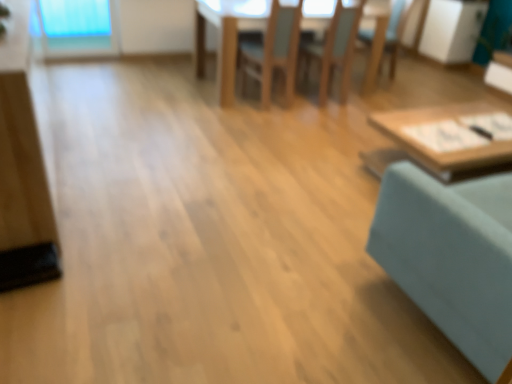
Question: Does teal fabric swivel chair at right lie in front of wooden chair at center, which is the 1th chair from left to right?

Choices:
 (A) no
 (B) yes

Answer: (B)

Question: Is teal fabric swivel chair at right thinner than wooden chair at center, positioned as the 3th chair in right-to-left order?

Choices:
 (A) yes
 (B) no

Answer: (B)

Question: Considering the relative sizes of teal fabric swivel chair at right and wooden chair at center, which is the 1th chair from left to right, in the image provided, is teal fabric swivel chair at right shorter than wooden chair at center, which is the 1th chair from left to right,?

Choices:
 (A) yes
 (B) no

Answer: (A)

Question: Does teal fabric swivel chair at right have a greater height compared to wooden chair at center, positioned as the 3th chair in right-to-left order?

Choices:
 (A) no
 (B) yes

Answer: (A)

Question: Is the position of teal fabric swivel chair at right more distant than that of wooden chair at center, positioned as the 3th chair in right-to-left order?

Choices:
 (A) yes
 (B) no

Answer: (B)

Question: In terms of height, does wooden table at center, the second table when ordered from front to back, look taller or shorter compared to wooden chair at center, the 1th chair when ordered from right to left?

Choices:
 (A) short
 (B) tall

Answer: (A)

Question: Looking at the image, does wooden table at center, which is counted as the first table, starting from the back, seem bigger or smaller compared to wooden chair at center, the third chair in the left-to-right sequence?

Choices:
 (A) big
 (B) small

Answer: (A)

Question: From the image's perspective, relative to wooden chair at center, the third chair in the left-to-right sequence, is wooden table at center, positioned as the 1th table in top-to-bottom order, above or below?

Choices:
 (A) below
 (B) above

Answer: (A)

Question: Do you think wooden table at center, the second table when ordered from front to back, is within wooden chair at center, the third chair in the left-to-right sequence, or outside of it?

Choices:
 (A) inside
 (B) outside

Answer: (B)

Question: In terms of size, does wooden chair at center, which is the 1th chair from left to right, appear bigger or smaller than teal fabric swivel chair at right?

Choices:
 (A) big
 (B) small

Answer: (B)

Question: Considering the positions of point (263, 67) and point (481, 178), is point (263, 67) closer or farther from the camera than point (481, 178)?

Choices:
 (A) closer
 (B) farther

Answer: (B)

Question: Considering the positions of wooden chair at center, which is the 1th chair from left to right, and teal fabric swivel chair at right in the image, is wooden chair at center, which is the 1th chair from left to right, wider or thinner than teal fabric swivel chair at right?

Choices:
 (A) wide
 (B) thin

Answer: (B)

Question: Would you say wooden chair at center, which is the 1th chair from left to right, is inside or outside teal fabric swivel chair at right?

Choices:
 (A) outside
 (B) inside

Answer: (A)

Question: Considering the relative positions of wooden chair at center, which is the 1th chair from left to right, and wooden chair at center, the third chair in the left-to-right sequence, in the image provided, is wooden chair at center, which is the 1th chair from left to right, to the left or to the right of wooden chair at center, the third chair in the left-to-right sequence,?

Choices:
 (A) right
 (B) left

Answer: (B)

Question: From the image's perspective, is wooden chair at center, positioned as the 3th chair in right-to-left order, positioned above or below wooden chair at center, the 1th chair when ordered from right to left?

Choices:
 (A) below
 (B) above

Answer: (A)